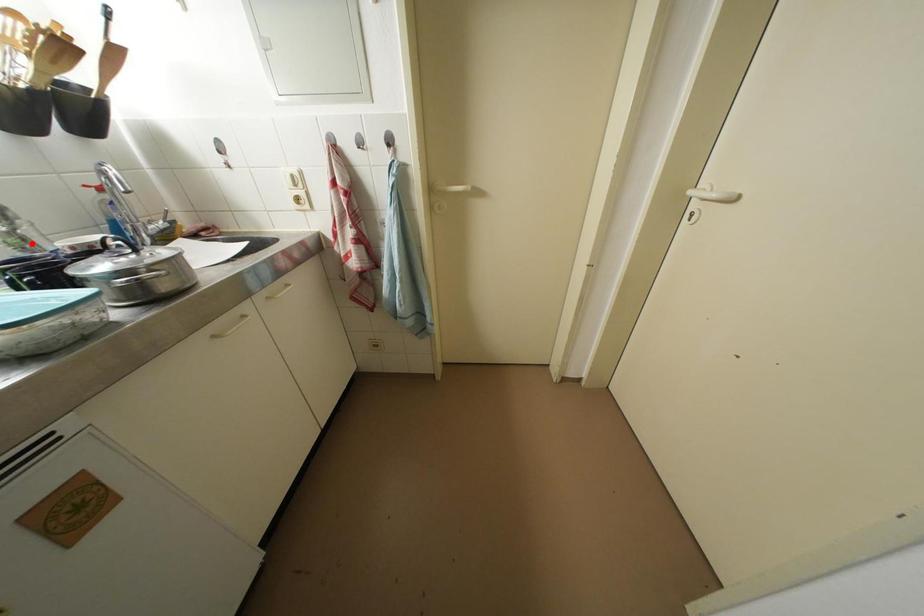
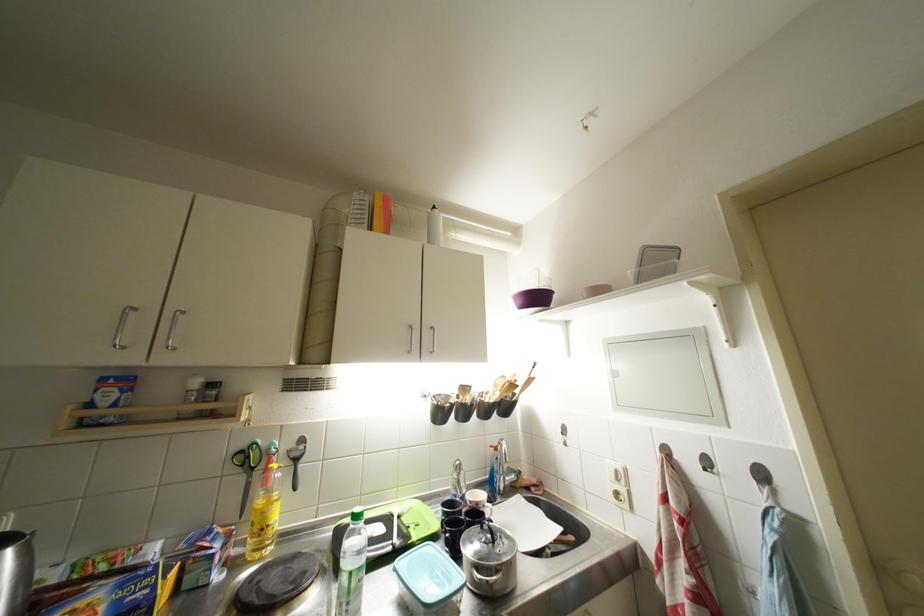
In the second image, find the point that corresponds to the highlighted location in the first image.

(466, 487)